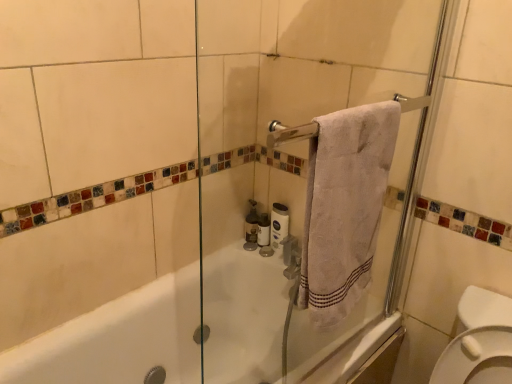
Question: Is white cotton towel at upper right bigger than matte glass soap dispenser at center?

Choices:
 (A) yes
 (B) no

Answer: (A)

Question: Is white cotton towel at upper right at the left side of matte glass soap dispenser at center?

Choices:
 (A) no
 (B) yes

Answer: (A)

Question: Is white cotton towel at upper right oriented away from matte glass soap dispenser at center?

Choices:
 (A) yes
 (B) no

Answer: (B)

Question: From a real-world perspective, is white cotton towel at upper right physically below matte glass soap dispenser at center?

Choices:
 (A) yes
 (B) no

Answer: (B)

Question: Could you tell me if white cotton towel at upper right is turned towards matte glass soap dispenser at center?

Choices:
 (A) yes
 (B) no

Answer: (B)

Question: Considering the relative positions of white cotton towel at upper right and matte glass soap dispenser at center in the image provided, is white cotton towel at upper right behind matte glass soap dispenser at center?

Choices:
 (A) no
 (B) yes

Answer: (A)

Question: Does transparent glass screen door at center touch white matte toilet paper at center, the 2th toilet paper positioned from the left?

Choices:
 (A) yes
 (B) no

Answer: (B)

Question: Does transparent glass screen door at center appear on the left side of white matte toilet paper at center, which is the first toilet paper in right-to-left order?

Choices:
 (A) yes
 (B) no

Answer: (B)

Question: Can you confirm if transparent glass screen door at center is bigger than white matte toilet paper at center, which is the first toilet paper in right-to-left order?

Choices:
 (A) yes
 (B) no

Answer: (A)

Question: Considering the relative sizes of transparent glass screen door at center and white matte toilet paper at center, the 2th toilet paper positioned from the left, in the image provided, is transparent glass screen door at center thinner than white matte toilet paper at center, the 2th toilet paper positioned from the left,?

Choices:
 (A) yes
 (B) no

Answer: (B)

Question: Is the position of transparent glass screen door at center more distant than that of white matte toilet paper at center, the 2th toilet paper positioned from the left?

Choices:
 (A) no
 (B) yes

Answer: (A)

Question: Can you confirm if transparent glass screen door at center is wider than white matte toilet paper at center, which is the first toilet paper in right-to-left order?

Choices:
 (A) no
 (B) yes

Answer: (B)

Question: Can you confirm if white cotton towel at upper right is wider than white matte toilet paper at center, which ranks as the first toilet paper in left-to-right order?

Choices:
 (A) no
 (B) yes

Answer: (B)